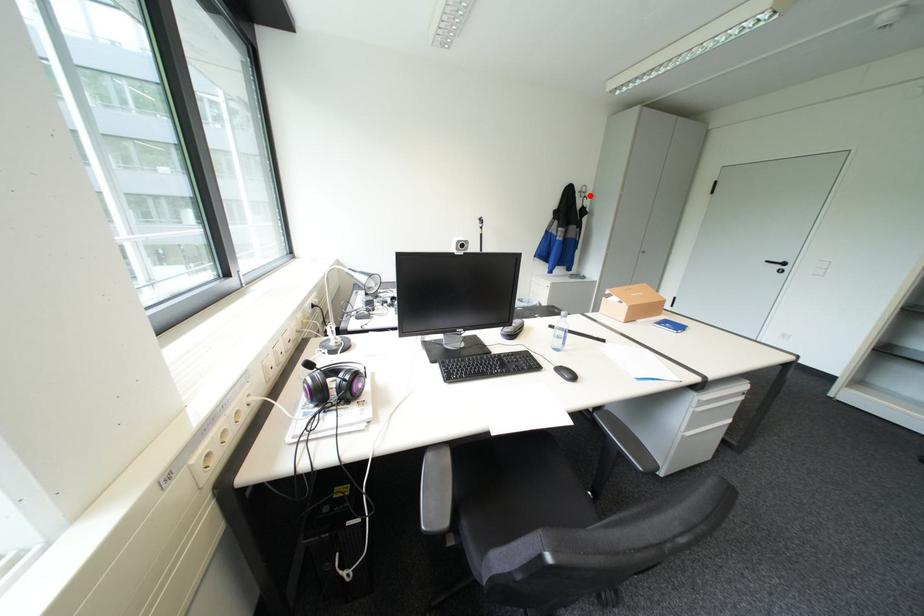
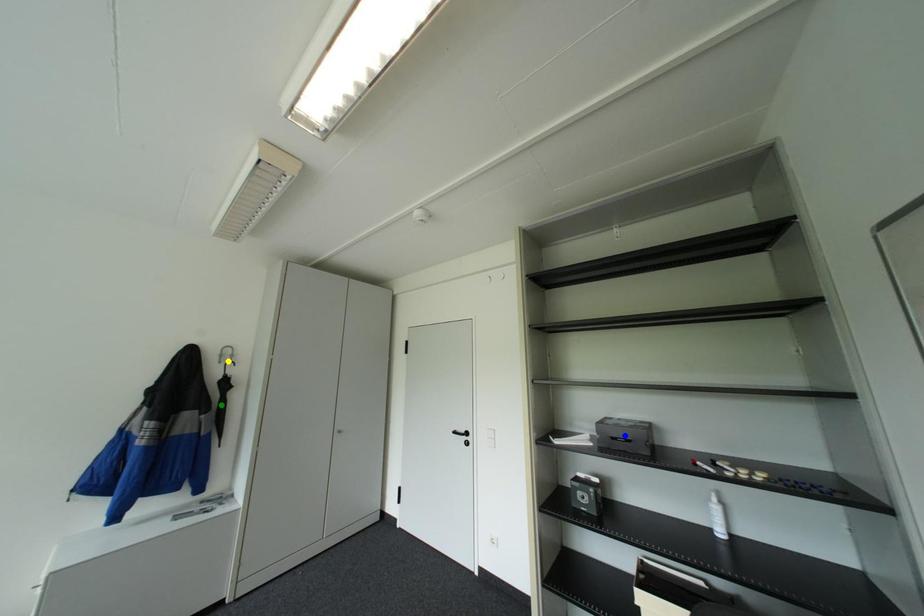
Question: I am providing you with two images of the same scene from different viewpoints. A red point is marked on the first image. You are given multiple points on the second image. In image 2, which mark is for the same physical point as the one in image 1?

Choices:
 (A) yellow point
 (B) blue point
 (C) green point

Answer: (A)